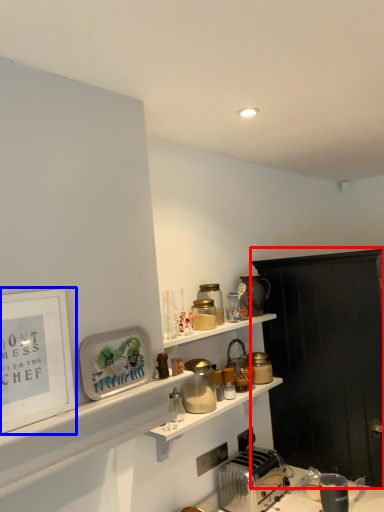
Question: Which point is further to the camera, cabinetry (highlighted by a red box) or picture frame (highlighted by a blue box)?

Choices:
 (A) cabinetry
 (B) picture frame

Answer: (A)